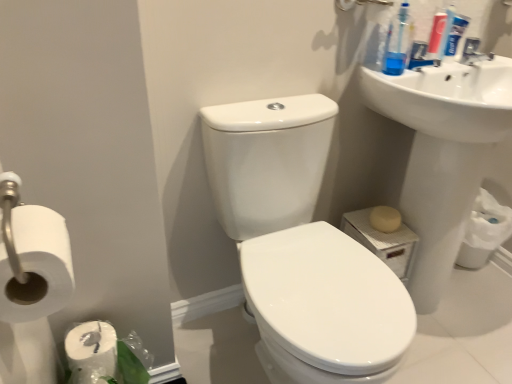
Question: Which is correct: blue plastic toothpaste tube at upper right, acting as the first cleaning product starting from the right, is inside white glossy toilet at center, or outside of it?

Choices:
 (A) inside
 (B) outside

Answer: (B)

Question: In the image, is blue plastic toothpaste tube at upper right, the second cleaning product positioned from the left, on the left side or the right side of white glossy toilet at center?

Choices:
 (A) right
 (B) left

Answer: (A)

Question: Estimate the real-world distances between objects in this image. Which object is farther from the white matte toilet paper at lower right, the 2th toilet paper viewed from the left?

Choices:
 (A) beige matte soap at lower right
 (B) blue plastic toothbrush at upper right, positioned as the second cleaning product in right-to-left order
 (C) blue plastic toothpaste tube at upper right, acting as the first cleaning product starting from the right
 (D) white matte toilet paper at left, which is the 1th toilet paper in front-to-back order
 (E) white glossy toilet at center

Answer: (D)

Question: Which object is positioned farthest from the white glossy toilet at center?

Choices:
 (A) blue plastic toothbrush at upper right, which is counted as the 1th cleaning product, starting from the left
 (B) white matte toilet paper at lower right, the 2th toilet paper viewed from the left
 (C) blue plastic toothpaste tube at upper right, acting as the first cleaning product starting from the right
 (D) beige matte soap at lower right
 (E) white glossy sink at upper right, which is the second sink from right to left

Answer: (B)